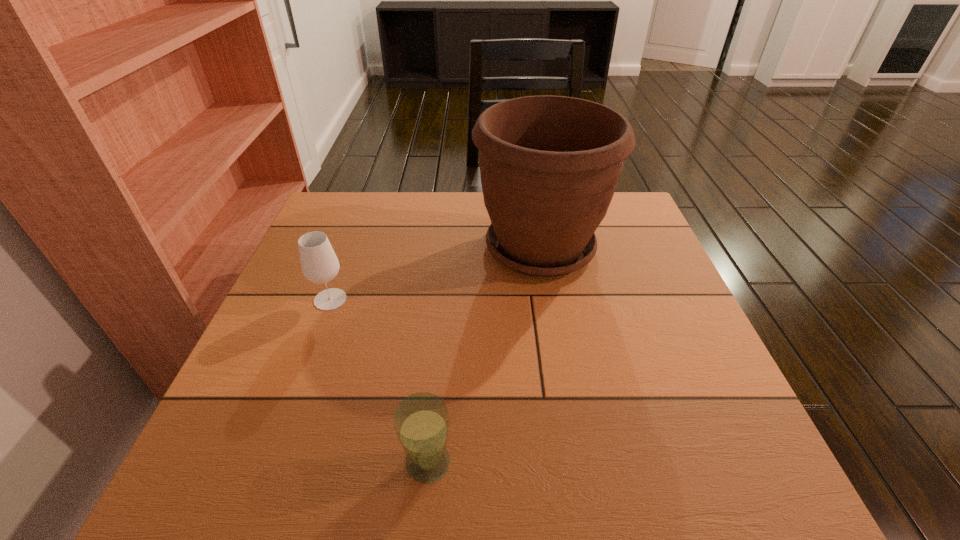
In order to click on unoccupied area between the nearest object and the second tallest object in this screenshot , I will do click(379, 381).

The width and height of the screenshot is (960, 540). I want to click on free spot between the second tallest object and the tallest object, so click(x=435, y=273).

This screenshot has width=960, height=540. Identify the location of vacant area between the nearer glass and the second tallest object. (379, 381).

At what (x,y) coordinates should I click in order to perform the action: click on vacant space in between the flowerpot and the shortest object. Please return your answer as a coordinate pair (x, y). Looking at the image, I should click on (484, 355).

Identify the location of free space between the rightmost object and the nearer glass. This screenshot has height=540, width=960. (484, 355).

What are the coordinates of `free space between the rightmost object and the left glass` in the screenshot? It's located at (435, 273).

You are a GUI agent. You are given a task and a screenshot of the screen. Output one action in this format:
    pyautogui.click(x=<x>, y=<y>)
    Task: Click on the blank region between the left glass and the nearer glass
    Image resolution: width=960 pixels, height=540 pixels.
    Given the screenshot: What is the action you would take?
    pyautogui.click(x=379, y=381)

Locate an element on the screen. This screenshot has width=960, height=540. free point between the shortest object and the flowerpot is located at coordinates (484, 355).

Identify which object is located as the nearest to the shortest object. Please provide its 2D coordinates. Your answer should be formatted as a tuple, i.e. [(x, y)], where the tuple contains the x and y coordinates of a point satisfying the conditions above.

[(319, 263)]

Locate which object is the closest to the rightmost object. Please provide its 2D coordinates. Your answer should be formatted as a tuple, i.e. [(x, y)], where the tuple contains the x and y coordinates of a point satisfying the conditions above.

[(319, 263)]